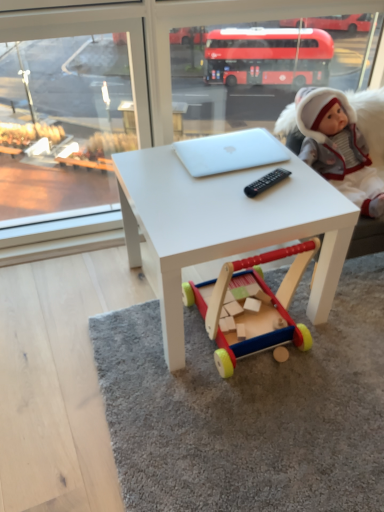
Looking at this image, what is the approximate width of wooden toy at center?

It is 14.65 inches.

The width and height of the screenshot is (384, 512). Describe the element at coordinates (230, 152) in the screenshot. I see `white matte laptop at center` at that location.

In order to click on wooden toy at center in this screenshot , I will do `click(245, 305)`.

Measure the distance from wooden toy at center to white plush doll at upper right.

The distance of wooden toy at center from white plush doll at upper right is 17.56 inches.

Does wooden toy at center have a greater height compared to white plush doll at upper right?

Yes.

The image size is (384, 512). Identify the location of person on the right of wooden toy at center. (338, 147).

Is wooden toy at center bigger than white plush doll at upper right?

Yes, wooden toy at center is bigger than white plush doll at upper right.

Identify the location of toy below the white plush doll at upper right (from the image's perspective). (245, 305).

From a real-world perspective, relative to wooden toy at center, is white plush doll at upper right vertically above or below?

white plush doll at upper right is above wooden toy at center.

Which is in front, point (343, 150) or point (268, 260)?

The point (268, 260) is closer to the camera.

Can you tell me how much white matte table at center and white plush doll at upper right differ in facing direction?

white matte table at center and white plush doll at upper right are facing 0.712 degrees away from each other.

Is white matte table at center facing towards white plush doll at upper right?

No, white matte table at center is not aimed at white plush doll at upper right.

From a real-world perspective, is white matte table at center above or below white plush doll at upper right?

In terms of real-world spatial position, white matte table at center is below white plush doll at upper right.

Which object is wider, white matte laptop at center or white matte table at center?

Wider between the two is white matte table at center.

Consider the image. Considering the sizes of objects white matte laptop at center and white matte table at center in the image provided, who is taller, white matte laptop at center or white matte table at center?

With more height is white matte table at center.

In the scene shown: Who is bigger, white matte laptop at center or white matte table at center?

white matte table at center.

Which is more to the left, white matte table at center or wooden toy at center?

From the viewer's perspective, white matte table at center appears more on the left side.

Between white matte table at center and wooden toy at center, which one has larger width?

Wider between the two is white matte table at center.

Is wooden toy at center located within white matte table at center?

Yes, wooden toy at center is a part of white matte table at center.

Looking at this image, from a real-world perspective, is white matte table at center beneath wooden toy at center?

No, from a real-world perspective, white matte table at center is not below wooden toy at center.

Could you tell me if wooden toy at center is turned towards white matte laptop at center?

No, wooden toy at center does not turn towards white matte laptop at center.

Considering the sizes of objects wooden toy at center and white matte laptop at center in the image provided, who is wider, wooden toy at center or white matte laptop at center?

wooden toy at center is wider.

Which point is more distant from viewer, (234, 292) or (262, 156)?

The point (234, 292) is more distant.

In the scene shown: Is the depth of white plush doll at upper right greater than that of white matte table at center?

Yes, it is.

Is white plush doll at upper right far away from white matte table at center?

white plush doll at upper right is near white matte table at center, not far away.

Is white plush doll at upper right to the left or to the right of white matte table at center in the image?

white plush doll at upper right is to the right of white matte table at center.

Is white matte table at center completely or partially inside white plush doll at upper right?

That's incorrect, white matte table at center is not inside white plush doll at upper right.

Locate an element on the screen. toy that appears below the white plush doll at upper right (from a real-world perspective) is located at coordinates (245, 305).

This screenshot has height=512, width=384. What are the coordinates of `person that is on the right side of wooden toy at center` in the screenshot? It's located at (338, 147).

When comparing their distances from white matte table at center, does white matte laptop at center or wooden toy at center seem further?

white matte laptop at center is positioned further to the anchor white matte table at center.

Considering their positions, is white matte table at center positioned further to white matte laptop at center than white plush doll at upper right?

white plush doll at upper right.

Considering their positions, is white plush doll at upper right positioned closer to wooden toy at center than white matte laptop at center?

white matte laptop at center lies closer to wooden toy at center than the other object.

Which object lies nearer to the anchor point white plush doll at upper right, white matte laptop at center or wooden toy at center?

Based on the image, white matte laptop at center appears to be nearer to white plush doll at upper right.

In the scene shown: Which object lies further to the anchor point wooden toy at center, white matte table at center or white matte laptop at center?

The object further to wooden toy at center is white matte laptop at center.

Based on the photo, estimate the real-world distances between objects in this image. Which object is further from white plush doll at upper right, white matte table at center or wooden toy at center?

The object further to white plush doll at upper right is wooden toy at center.

From the image, which object appears to be nearer to white matte laptop at center, white plush doll at upper right or wooden toy at center?

white plush doll at upper right lies closer to white matte laptop at center than the other object.

When comparing their distances from wooden toy at center, does white matte laptop at center or white plush doll at upper right seem closer?

Based on the image, white matte laptop at center appears to be nearer to wooden toy at center.

The image size is (384, 512). Find the location of `table between white matte laptop at center and wooden toy at center from top to bottom`. table between white matte laptop at center and wooden toy at center from top to bottom is located at coordinates (223, 226).

The width and height of the screenshot is (384, 512). Identify the location of laptop between white matte table at center and white plush doll at upper right in the horizontal direction. tap(230, 152).

The image size is (384, 512). I want to click on laptop between white plush doll at upper right and wooden toy at center vertically, so point(230,152).

The width and height of the screenshot is (384, 512). In order to click on toy situated between white matte table at center and white plush doll at upper right from left to right in this screenshot , I will do `click(245, 305)`.